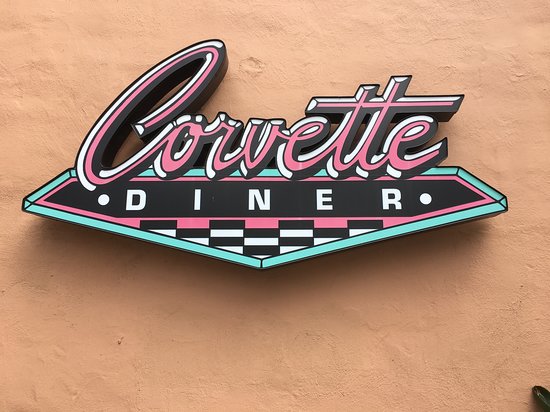
At what (x,y) coordinates should I click in order to perform the action: click on black and white checkerboard pattern. Please return your answer as a coordinate pair (x, y). This screenshot has height=412, width=550. Looking at the image, I should click on (298, 242), (274, 244), (238, 241), (219, 232).